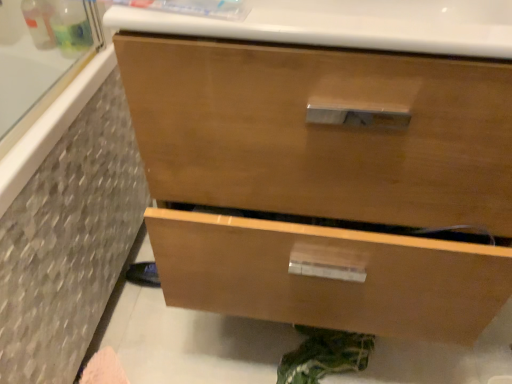
This screenshot has width=512, height=384. I want to click on matte gray tile at left, so click(x=69, y=230).

What is the approximate width of matte gray tile at left?

The width of matte gray tile at left is 22.11 inches.

This screenshot has height=384, width=512. Describe the element at coordinates (69, 230) in the screenshot. I see `matte gray tile at left` at that location.

Describe the element at coordinates (321, 132) in the screenshot. I see `glossy wood drawer at center` at that location.

Find the location of a particular element. This screenshot has width=512, height=384. glossy wood drawer at center is located at coordinates (321, 132).

I want to click on matte gray tile at left, so [x=69, y=230].

Considering the relative positions of glossy wood drawer at center and matte gray tile at left in the image provided, is glossy wood drawer at center to the left of matte gray tile at left from the viewer's perspective?

In fact, glossy wood drawer at center is to the right of matte gray tile at left.

Which object is closer to the camera, glossy wood drawer at center or matte gray tile at left?

glossy wood drawer at center is closer to the camera.

Which is nearer, (208, 162) or (81, 310)?

Point (208, 162) is positioned closer to the camera compared to point (81, 310).

From the image's perspective, which is above, glossy wood drawer at center or matte gray tile at left?

glossy wood drawer at center, from the image's perspective.

From a real-world perspective, is glossy wood drawer at center below matte gray tile at left?

No, from a real-world perspective, glossy wood drawer at center is not below matte gray tile at left.

Looking at this image, considering the sizes of glossy wood drawer at center and matte gray tile at left in the image, is glossy wood drawer at center wider or thinner than matte gray tile at left?

glossy wood drawer at center is thinner than matte gray tile at left.

In the scene shown: Who is shorter, glossy wood drawer at center or matte gray tile at left?

matte gray tile at left.

Is glossy wood drawer at center smaller than matte gray tile at left?

Incorrect, glossy wood drawer at center is not smaller in size than matte gray tile at left.

Is glossy wood drawer at center spatially inside matte gray tile at left, or outside of it?

glossy wood drawer at center is located beyond the bounds of matte gray tile at left.

Looking at this image, are glossy wood drawer at center and matte gray tile at left far apart?

No, glossy wood drawer at center is not far from matte gray tile at left.

Could you tell me if glossy wood drawer at center is turned towards matte gray tile at left?

No, glossy wood drawer at center is not aimed at matte gray tile at left.

How different are the orientations of glossy wood drawer at center and matte gray tile at left in degrees?

The angular difference between glossy wood drawer at center and matte gray tile at left is 90.4 degrees.

The height and width of the screenshot is (384, 512). In the image, there is a glossy wood drawer at center. What are the coordinates of `bath below it (from a real-world perspective)` in the screenshot? It's located at (69, 230).

In the image, is matte gray tile at left on the left side or the right side of glossy wood drawer at center?

matte gray tile at left is to the left of glossy wood drawer at center.

Is matte gray tile at left in front of or behind glossy wood drawer at center in the image?

Visually, matte gray tile at left is located behind glossy wood drawer at center.

Between point (89, 179) and point (416, 110), which one is positioned in front?

The point (416, 110) is in front.

From the image's perspective, is matte gray tile at left below glossy wood drawer at center?

Yes, from the image's perspective, matte gray tile at left is beneath glossy wood drawer at center.

From a real-world perspective, does matte gray tile at left stand above glossy wood drawer at center?

No, from a real-world perspective, matte gray tile at left is not over glossy wood drawer at center

Considering the relative sizes of matte gray tile at left and glossy wood drawer at center in the image provided, is matte gray tile at left thinner than glossy wood drawer at center?

Incorrect, the width of matte gray tile at left is not less than that of glossy wood drawer at center.

Between matte gray tile at left and glossy wood drawer at center, which one has more height?

With more height is glossy wood drawer at center.

Based on the photo, which of these two, matte gray tile at left or glossy wood drawer at center, is bigger?

glossy wood drawer at center is bigger.

Can we say matte gray tile at left lies outside glossy wood drawer at center?

matte gray tile at left is positioned outside glossy wood drawer at center.

Is matte gray tile at left directly adjacent to glossy wood drawer at center?

They are not placed beside each other.

From the picture: Is matte gray tile at left positioned with its back to glossy wood drawer at center?

No, glossy wood drawer at center is not at the back of matte gray tile at left.

Measure the distance from matte gray tile at left to glossy wood drawer at center.

matte gray tile at left is 16.15 inches from glossy wood drawer at center.

Identify the location of bath that is behind the glossy wood drawer at center. The width and height of the screenshot is (512, 384). (69, 230).

You are a GUI agent. You are given a task and a screenshot of the screen. Output one action in this format:
    pyautogui.click(x=<x>, y=<y>)
    Task: Click on the bath that is behind the glossy wood drawer at center
    
    Given the screenshot: What is the action you would take?
    pyautogui.click(x=69, y=230)

Where is `bath that appears on the left of glossy wood drawer at center`? The height and width of the screenshot is (384, 512). bath that appears on the left of glossy wood drawer at center is located at coordinates (69, 230).